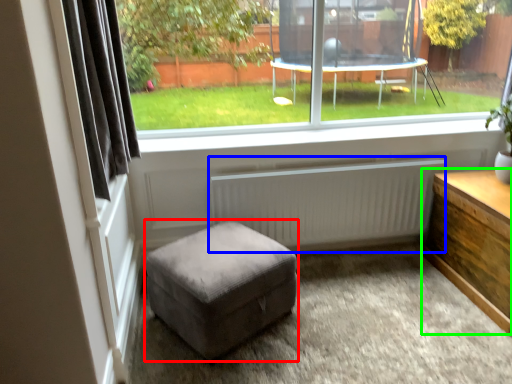
Question: Based on their relative distances, which object is nearer to stool (highlighted by a red box)? Choose from radiator (highlighted by a blue box) and table (highlighted by a green box).

Choices:
 (A) radiator
 (B) table

Answer: (A)